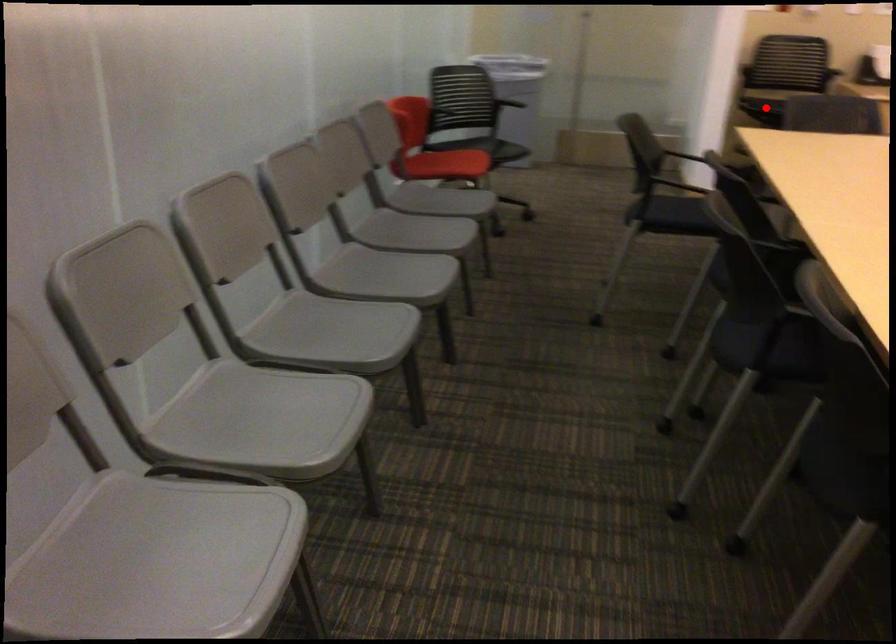
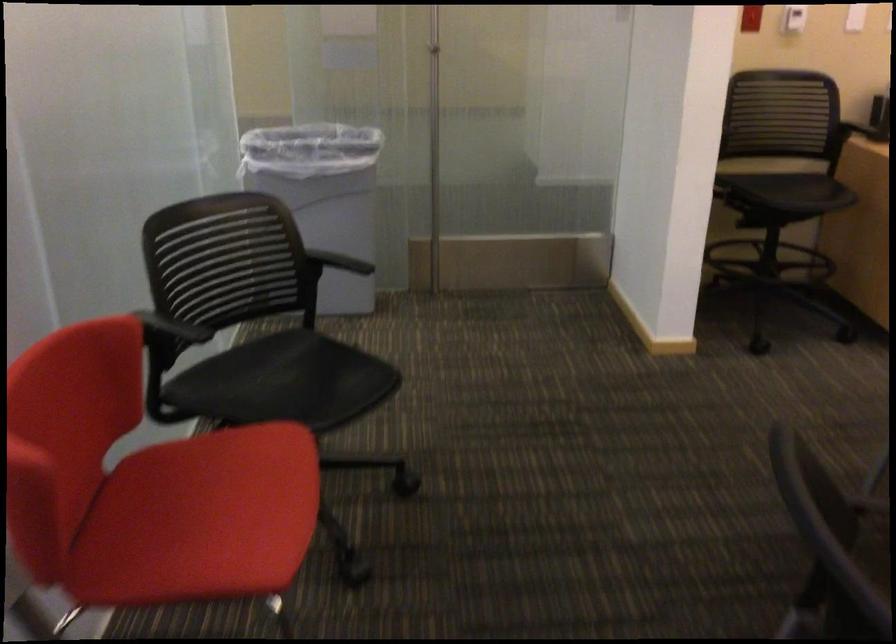
Question: I am providing you with two images of the same scene from different viewpoints. A red point is marked on the first image. Is the red point's position out of view in image 2?

Choices:
 (A) Yes
 (B) No

Answer: (B)